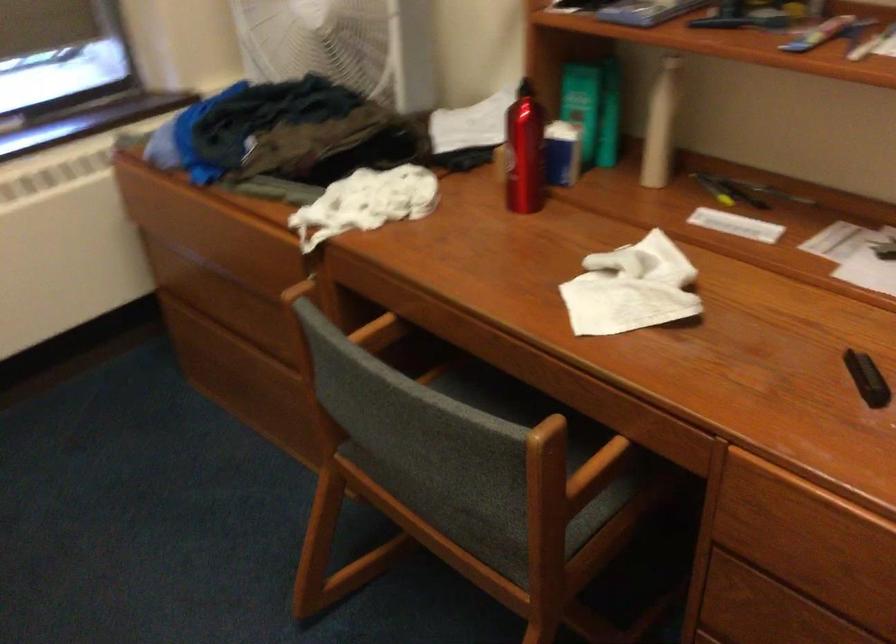
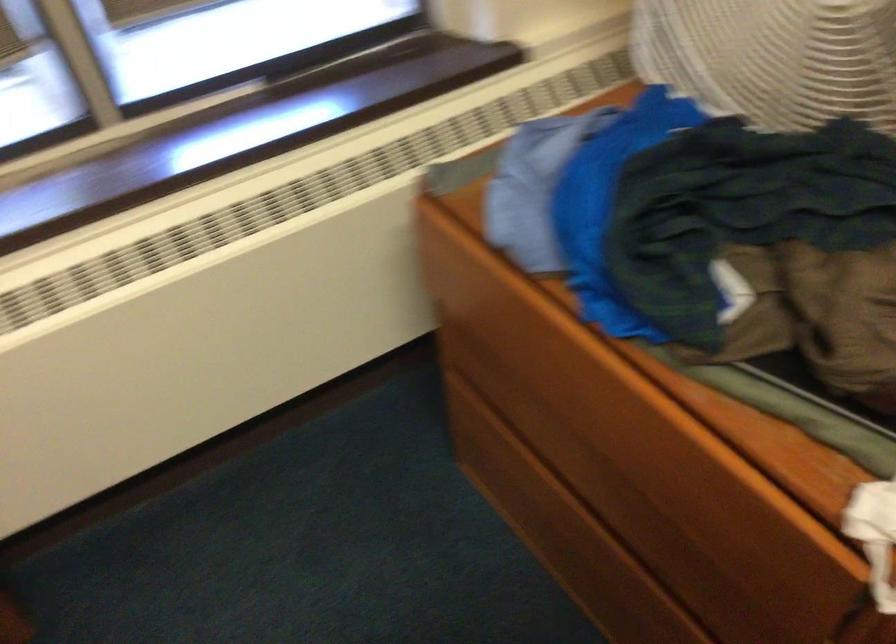
In a continuous first-person perspective shot, in which direction is the camera moving?

The cameraman walked toward left, forward.